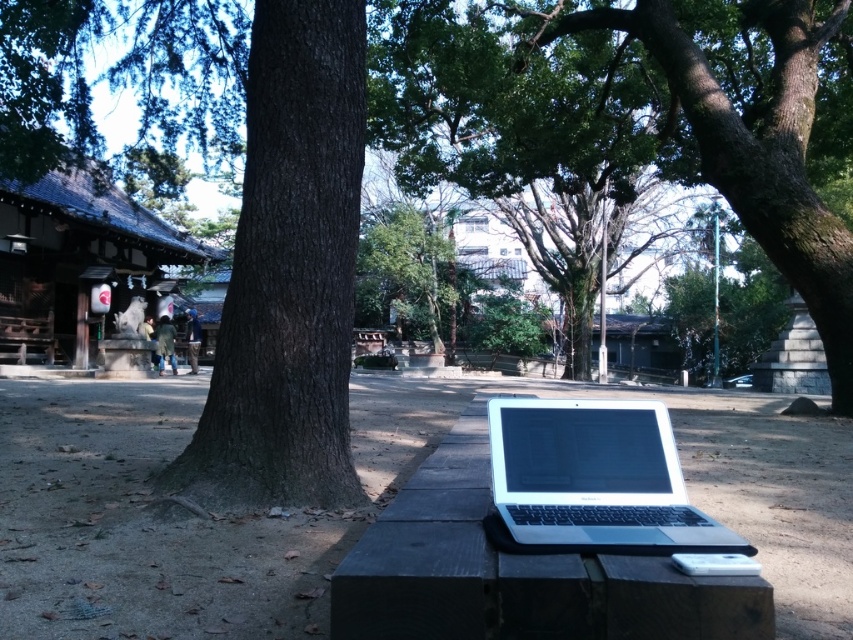
Does dirt field at center have a larger size compared to wooden shrine at left?

No, dirt field at center is not bigger than wooden shrine at left.

Between point (108, 388) and point (7, 284), which one is positioned behind?

Positioned behind is point (7, 284).

The height and width of the screenshot is (640, 853). Find the location of `dirt field at center`. dirt field at center is located at coordinates (140, 525).

Which is behind, point (547, 580) or point (62, 246)?

Point (62, 246)

Can you confirm if wooden bench at center is positioned below wooden shrine at left?

Correct, wooden bench at center is located below wooden shrine at left.

Is point (474, 580) positioned behind point (15, 179)?

No, it is in front of (15, 179).

Where is `wooden bench at center`? wooden bench at center is located at coordinates (514, 572).

Is green leafy tree at center taller than white glossy laptop at center?

Yes, green leafy tree at center is taller than white glossy laptop at center.

Measure the distance from green leafy tree at center to white glossy laptop at center.

green leafy tree at center is 3.51 meters away from white glossy laptop at center.

Does point (711, 145) lie in front of point (656, 420)?

No, it is behind (656, 420).

You are a GUI agent. You are given a task and a screenshot of the screen. Output one action in this format:
    pyautogui.click(x=<x>, y=<y>)
    Task: Click on the green leafy tree at center
    This screenshot has height=640, width=853.
    Given the screenshot: What is the action you would take?
    pyautogui.click(x=753, y=147)